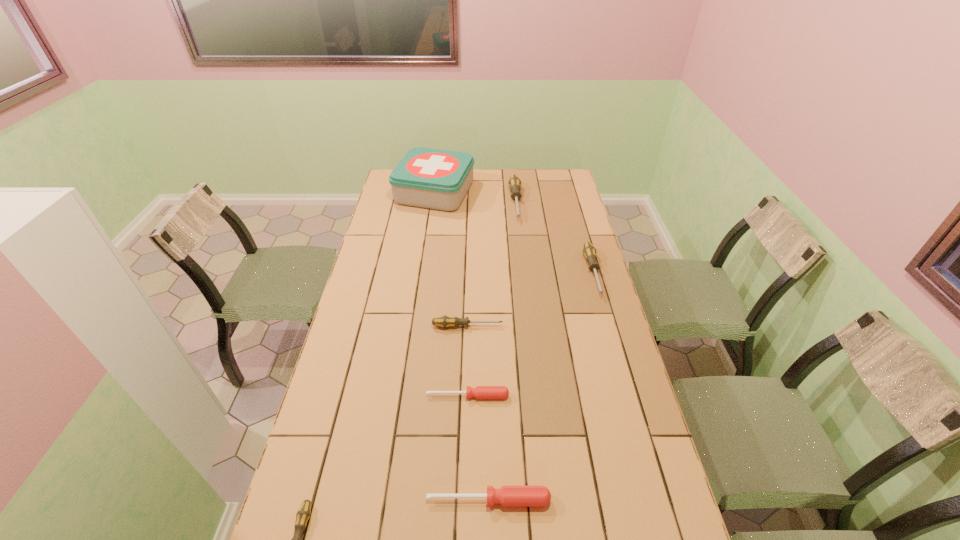
Where is `the tallest object`? This screenshot has width=960, height=540. the tallest object is located at coordinates (437, 179).

Where is `teal first-aid kit`? teal first-aid kit is located at coordinates (437, 179).

At what (x,y) coordinates should I click in order to perform the action: click on the third gray screwdriver from left to right. Please return your answer as a coordinate pair (x, y). The height and width of the screenshot is (540, 960). Looking at the image, I should click on (514, 183).

Identify the location of the second tallest object. This screenshot has height=540, width=960. (514, 183).

Where is `the second biggest gray screwdriver`? The height and width of the screenshot is (540, 960). the second biggest gray screwdriver is located at coordinates (589, 251).

I want to click on the fifth shortest screwdriver, so click(589, 251).

You are a GUI agent. You are given a task and a screenshot of the screen. Output one action in this format:
    pyautogui.click(x=<x>, y=<y>)
    Task: Click on the third farthest gray screwdriver
    
    Given the screenshot: What is the action you would take?
    pyautogui.click(x=444, y=321)

Identify the location of the third farthest screwdriver. (444, 321).

The image size is (960, 540). I want to click on the nearer red screwdriver, so click(508, 496).

Locate an element on the screen. the fifth farthest object is located at coordinates (480, 392).